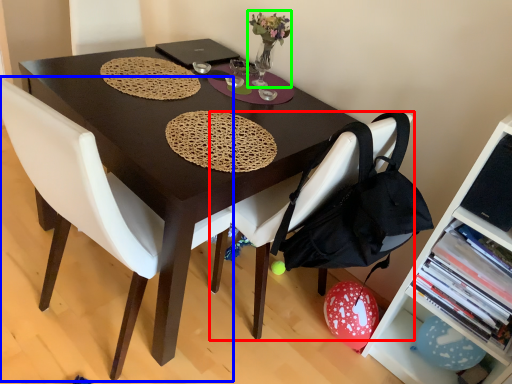
Question: Estimate the real-world distances between objects in this image. Which object is closer to chair (highlighted by a red box), chair (highlighted by a blue box) or floral arrangement (highlighted by a green box)?

Choices:
 (A) chair
 (B) floral arrangement

Answer: (A)